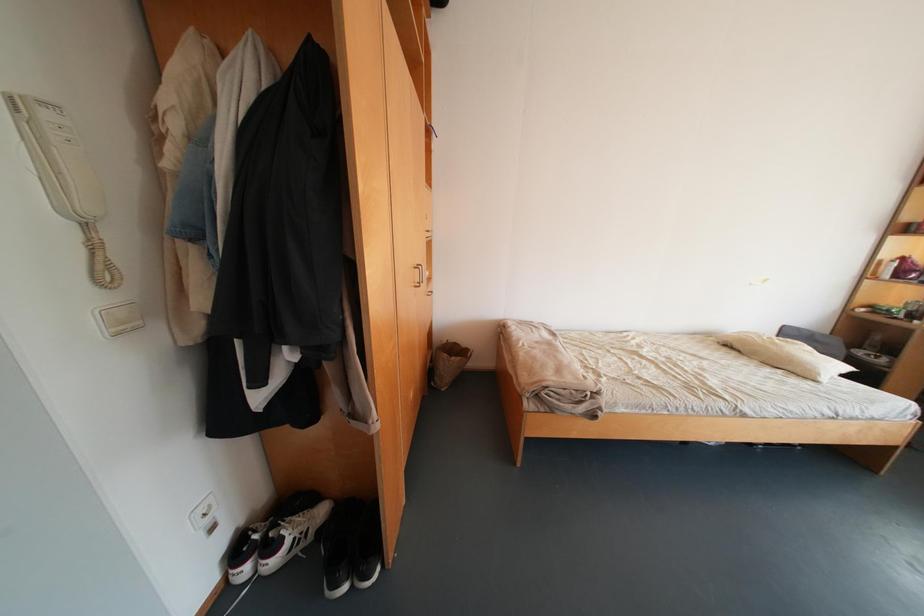
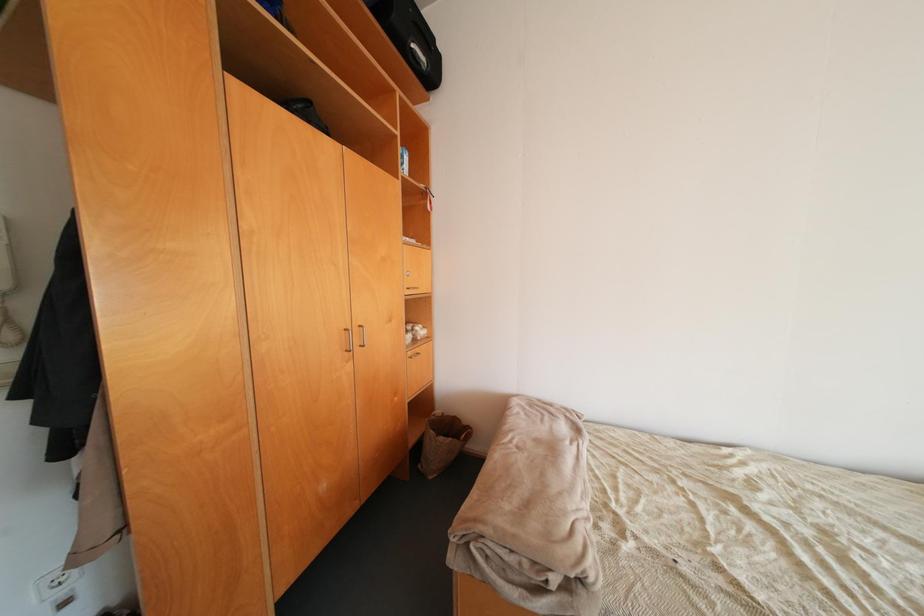
Question: The images are taken continuously from a first-person perspective. In which direction is your viewpoint rotating?

Choices:
 (A) Left
 (B) Right
 (C) Up
 (D) Down

Answer: (A)